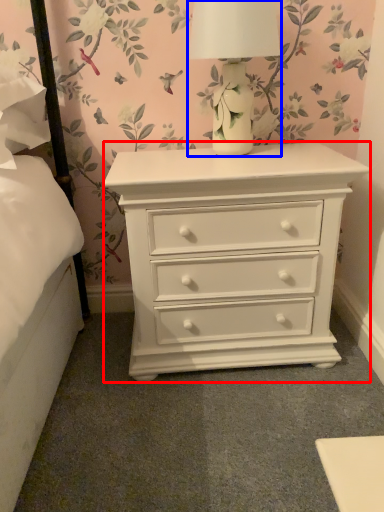
Question: Among these objects, which one is nearest to the camera, nightstand (highlighted by a red box) or table lamp (highlighted by a blue box)?

Choices:
 (A) nightstand
 (B) table lamp

Answer: (B)